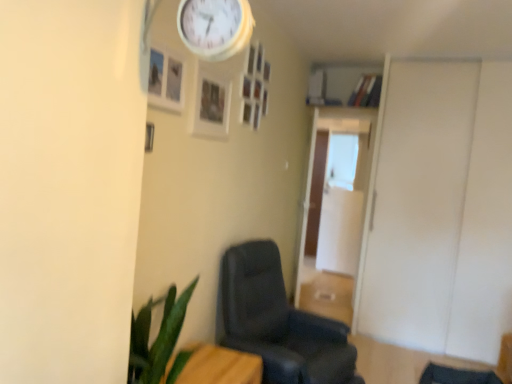
Question: Is white matte door at right outside of wooden table at lower left?

Choices:
 (A) no
 (B) yes

Answer: (B)

Question: From the image's perspective, does white matte door at right appear lower than wooden table at lower left?

Choices:
 (A) yes
 (B) no

Answer: (B)

Question: Considering the relative sizes of white matte door at right and wooden table at lower left in the image provided, is white matte door at right shorter than wooden table at lower left?

Choices:
 (A) yes
 (B) no

Answer: (B)

Question: Can you confirm if white matte door at right is wider than wooden table at lower left?

Choices:
 (A) yes
 (B) no

Answer: (A)

Question: From a real-world perspective, is white matte door at right physically below wooden table at lower left?

Choices:
 (A) no
 (B) yes

Answer: (A)

Question: Is transparent glass door at center, which ranks as the second glass door in back-to-front order, situated inside wooden table at lower left or outside?

Choices:
 (A) outside
 (B) inside

Answer: (A)

Question: In terms of height, does transparent glass door at center, which appears as the first glass door when viewed from the front, look taller or shorter compared to wooden table at lower left?

Choices:
 (A) short
 (B) tall

Answer: (B)

Question: Based on their sizes in the image, would you say transparent glass door at center, which ranks as the second glass door in back-to-front order, is bigger or smaller than wooden table at lower left?

Choices:
 (A) big
 (B) small

Answer: (B)

Question: Considering their positions, is transparent glass door at center, which ranks as the second glass door in back-to-front order, located in front of or behind wooden table at lower left?

Choices:
 (A) front
 (B) behind

Answer: (B)

Question: Is white matte door at right taller or shorter than wooden table at lower left?

Choices:
 (A) tall
 (B) short

Answer: (A)

Question: Considering the relative positions of white matte door at right and wooden table at lower left in the image provided, is white matte door at right to the left or to the right of wooden table at lower left?

Choices:
 (A) left
 (B) right

Answer: (B)

Question: Is white matte door at right in front of or behind wooden table at lower left in the image?

Choices:
 (A) front
 (B) behind

Answer: (B)

Question: In terms of width, does white matte door at right look wider or thinner when compared to wooden table at lower left?

Choices:
 (A) wide
 (B) thin

Answer: (A)

Question: Considering the positions of matte black chair at center and white wooden clock at upper center in the image, is matte black chair at center bigger or smaller than white wooden clock at upper center?

Choices:
 (A) small
 (B) big

Answer: (B)

Question: Is matte black chair at center wider or thinner than white wooden clock at upper center?

Choices:
 (A) wide
 (B) thin

Answer: (A)